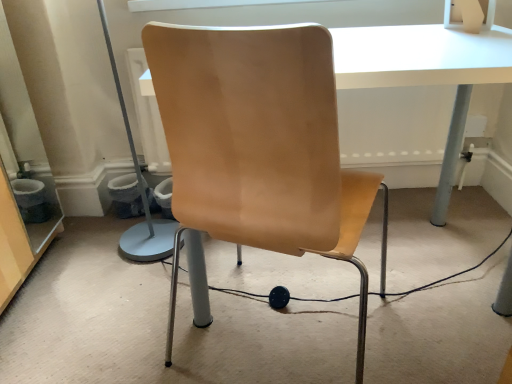
Question: From the image's perspective, is matte wood chair at center beneath white glossy table at center?

Choices:
 (A) no
 (B) yes

Answer: (B)

Question: Does matte wood chair at center have a greater width compared to white glossy table at center?

Choices:
 (A) yes
 (B) no

Answer: (B)

Question: Would you say matte wood chair at center is a long distance from white glossy table at center?

Choices:
 (A) yes
 (B) no

Answer: (B)

Question: From a real-world perspective, is matte wood chair at center on white glossy table at center?

Choices:
 (A) yes
 (B) no

Answer: (A)

Question: Considering the relative positions of matte wood chair at center and white glossy table at center in the image provided, is matte wood chair at center behind white glossy table at center?

Choices:
 (A) no
 (B) yes

Answer: (A)

Question: Can you confirm if matte wood chair at center is smaller than white glossy table at center?

Choices:
 (A) no
 (B) yes

Answer: (B)

Question: Can you confirm if white glossy table at center is smaller than matte wood chair at center?

Choices:
 (A) no
 (B) yes

Answer: (A)

Question: From the image's perspective, is white glossy table at center over matte wood chair at center?

Choices:
 (A) no
 (B) yes

Answer: (B)

Question: Can we say white glossy table at center lies outside matte wood chair at center?

Choices:
 (A) yes
 (B) no

Answer: (B)

Question: Is there a large distance between white glossy table at center and matte wood chair at center?

Choices:
 (A) yes
 (B) no

Answer: (B)

Question: From a real-world perspective, is white glossy table at center on top of matte wood chair at center?

Choices:
 (A) no
 (B) yes

Answer: (A)

Question: From a real-world perspective, is white glossy table at center located beneath matte wood chair at center?

Choices:
 (A) yes
 (B) no

Answer: (A)

Question: Based on their positions, is matte wood chair at center located to the left or right of white glossy table at center?

Choices:
 (A) right
 (B) left

Answer: (B)